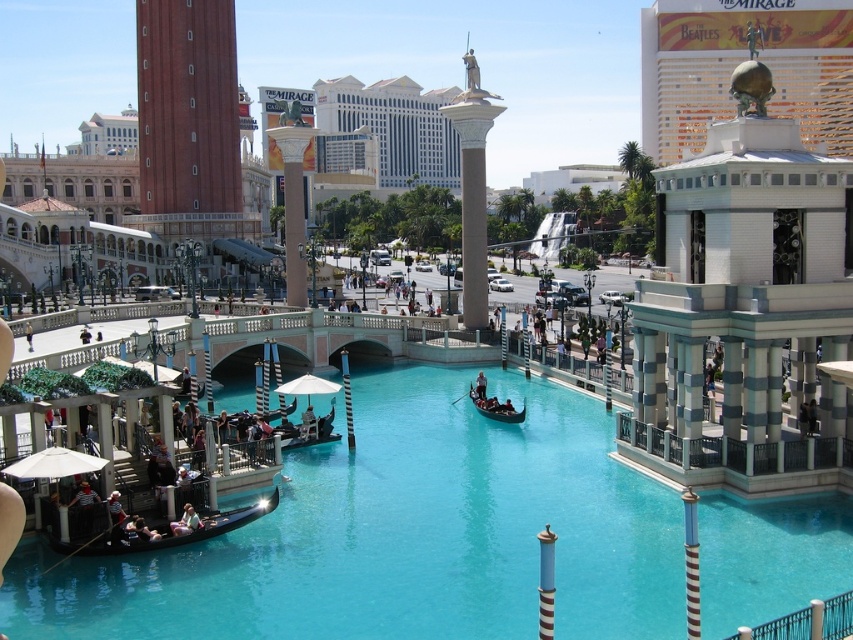
Question: Is terracotta brick tower at left to the left of smooth black boat at center from the viewer's perspective?

Choices:
 (A) no
 (B) yes

Answer: (B)

Question: Can you confirm if teal glossy water at center is thinner than smooth black boat at center?

Choices:
 (A) no
 (B) yes

Answer: (A)

Question: Among these objects, which one is nearest to the camera?

Choices:
 (A) smooth black boat at center
 (B) teal glossy water at center
 (C) terracotta brick tower at left

Answer: (B)

Question: Estimate the real-world distances between objects in this image. Which object is closer to the smooth black boat at center?

Choices:
 (A) terracotta brick tower at left
 (B) light blue fabric person at lower left
 (C) wooden gondola at center
 (D) teal glossy water at center

Answer: (C)

Question: Is teal glossy water at center to the left of smooth black boat at center from the viewer's perspective?

Choices:
 (A) no
 (B) yes

Answer: (A)

Question: Among these points, which one is nearest to the camera?

Choices:
 (A) (480, 372)
 (B) (485, 400)

Answer: (B)